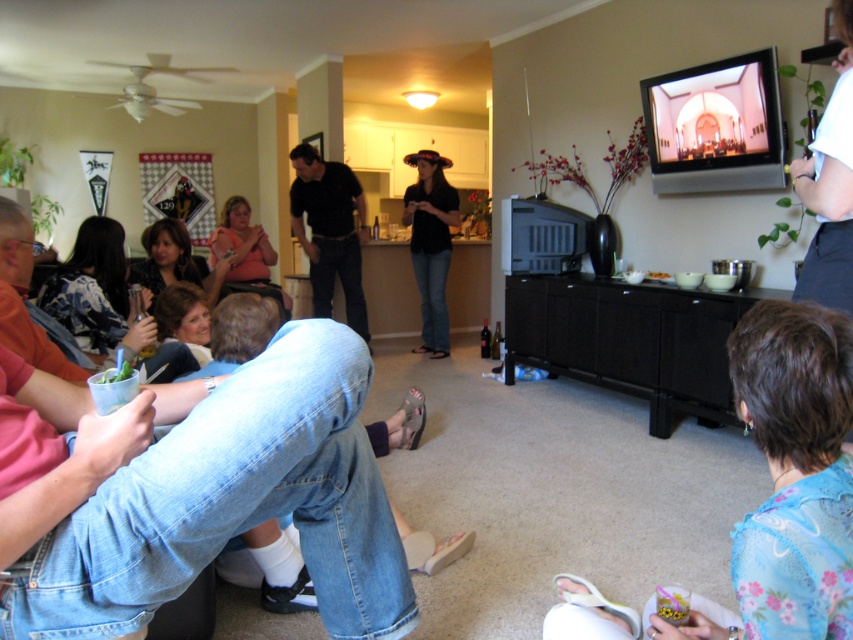
You are standing in the living room and see a point marked at coordinates (788, 481). What object or person is located at that point?

The point at coordinates (788, 481) corresponds to the blue floral shirt at lower right.

What is the object located at the coordinate point (329, 230) in the image?

The object at coordinate point (329, 230) is the black matte shirt at center.